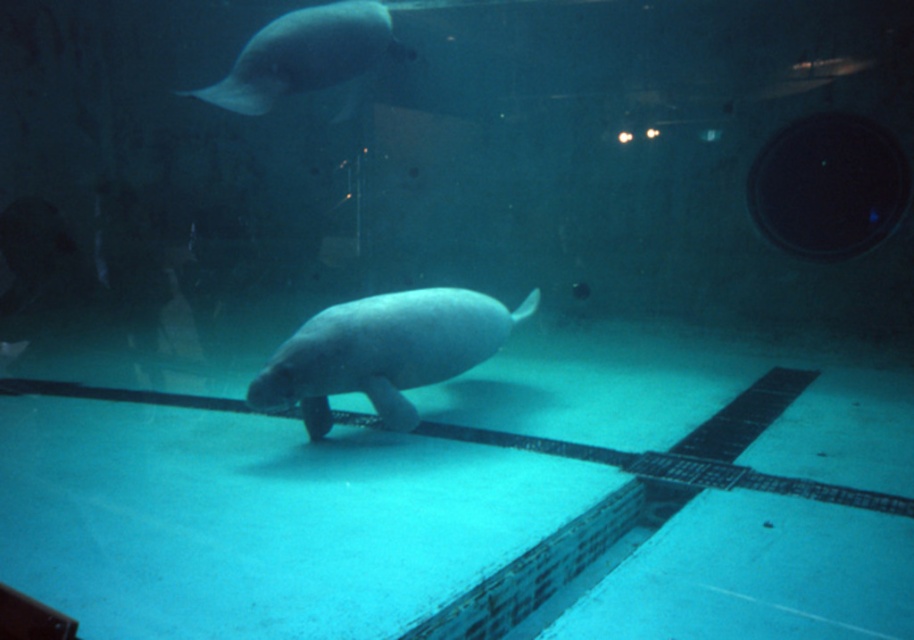
Who is taller, gray matte manatee at center or smooth gray fish at upper left?

With more height is smooth gray fish at upper left.

Consider the image. Which is more to the left, gray matte manatee at center or smooth gray fish at upper left?

smooth gray fish at upper left

Between point (303, 349) and point (335, 8), which one is positioned behind?

The point (335, 8) is more distant.

The image size is (914, 640). Find the location of `gray matte manatee at center`. gray matte manatee at center is located at coordinates (383, 353).